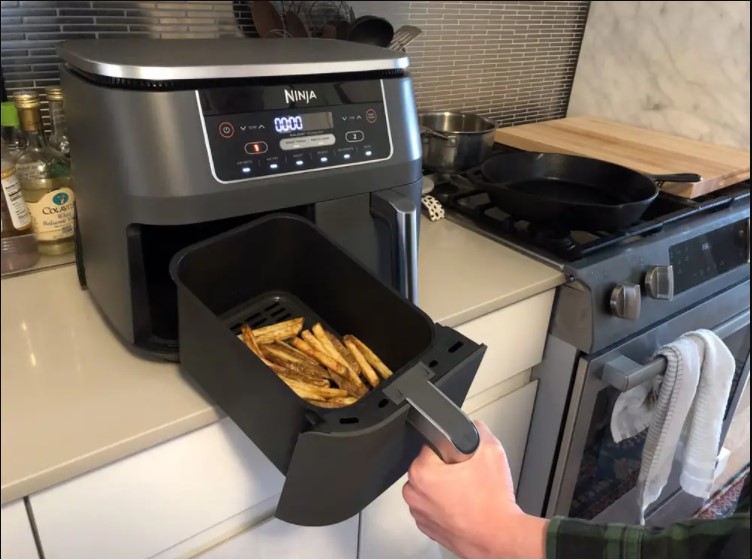
Identify the location of air fryer. Image resolution: width=752 pixels, height=560 pixels. (165, 185).